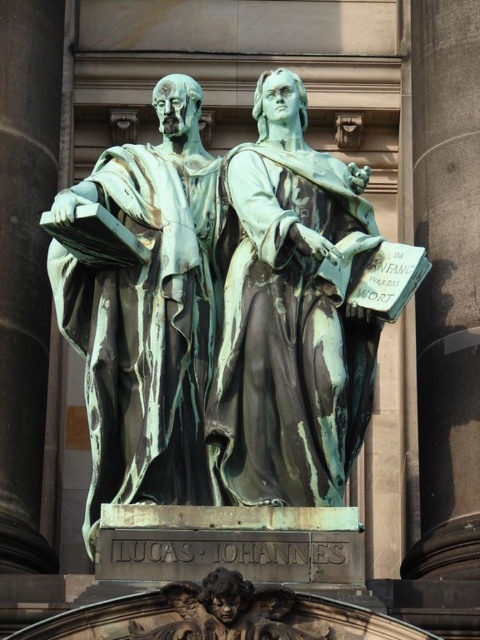
You are standing in front of the classical architecture with two bronze statues. The statues are positioned such that one is on the left and the other on the right. Which bronze statue at center is closer to the left edge of the image?

The bronze statue at center is located at point 0.494 on the horizontal axis, which is closer to the left edge of the image since 0.494 is less than 0.5.